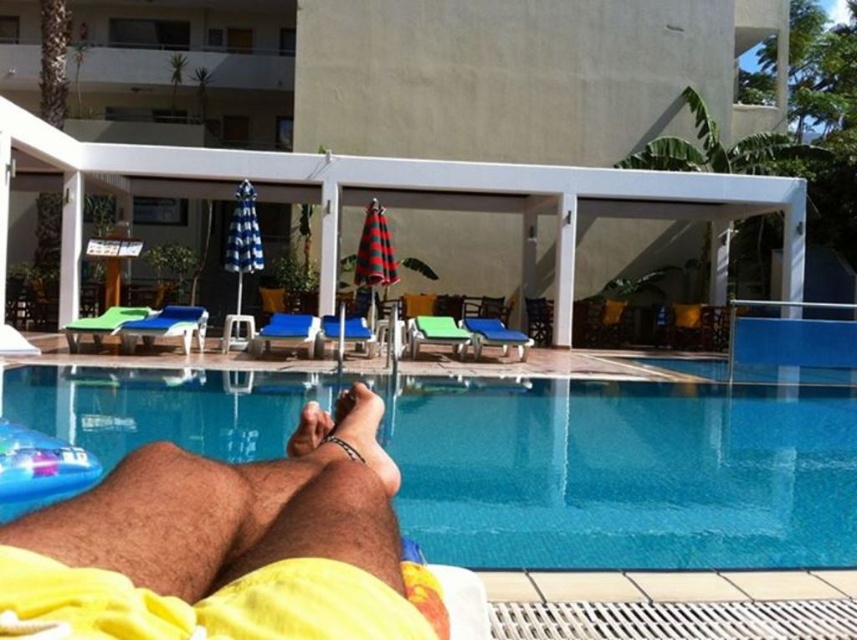
You are a guest at the resort and want to place your beach towel on the white plastic patio at center. However, you also have a small cooler that needs to be placed near the smooth skin foot at lower center. Considering their sizes, which object can accommodate the cooler more comfortably?

The white plastic patio at center is much taller than the smooth skin foot at lower center, so the cooler can be placed more comfortably on the white plastic patio at center.

From the picture: You are standing at the edge of the pool and want to place a new white plastic patio at center. According to the coordinates provided, where exactly should you place it?

The white plastic patio at center should be placed at the coordinates point (451, 140).